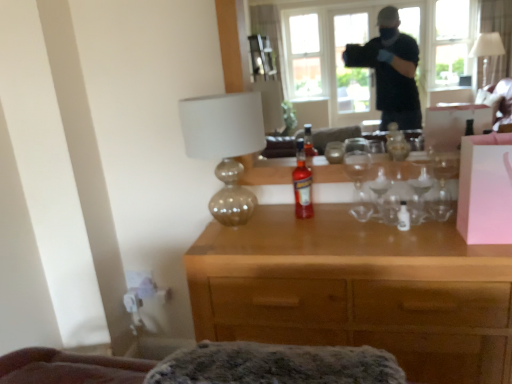
The image size is (512, 384). Identify the location of vacant space that's between translucent glass bottle at center and pink matte box at right. point(390,232).